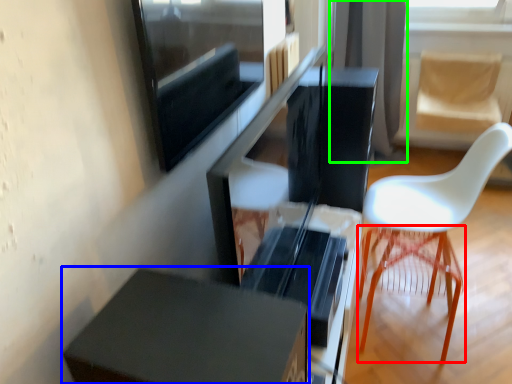
Question: Which object is the closest to the bar stool (highlighted by a red box)? Choose among these: furniture (highlighted by a blue box) or curtain (highlighted by a green box).

Choices:
 (A) furniture
 (B) curtain

Answer: (A)